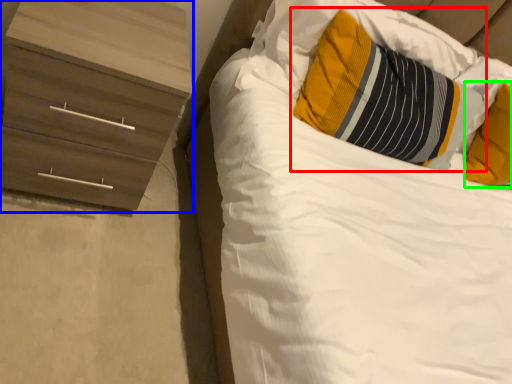
Question: Which object is the closest to the pillow (highlighted by a red box)? Choose among these: chest of drawers (highlighted by a blue box) or pillow (highlighted by a green box).

Choices:
 (A) chest of drawers
 (B) pillow

Answer: (B)